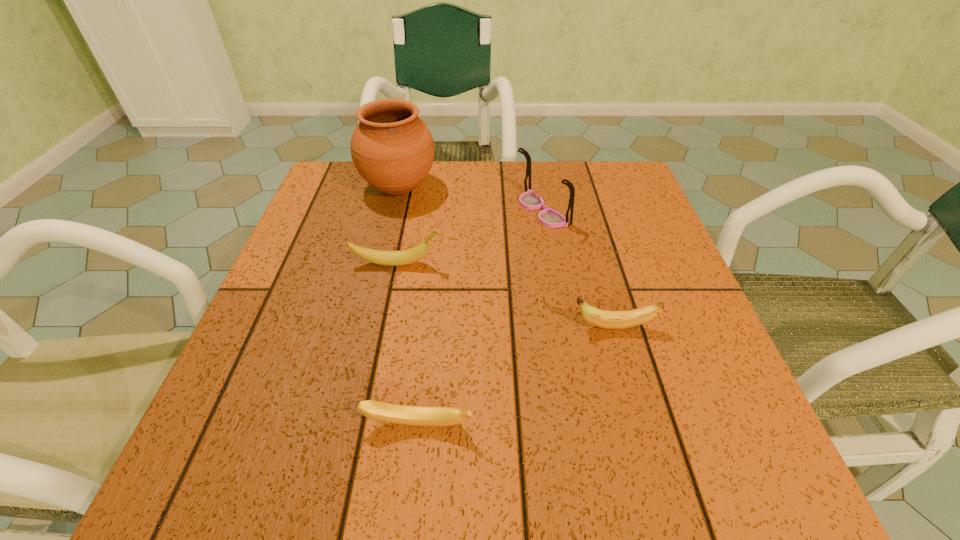
The width and height of the screenshot is (960, 540). In order to click on object that is at the far left corner in this screenshot , I will do `click(392, 149)`.

At what (x,y) coordinates should I click in order to perform the action: click on blank space at the far edge. Please return your answer as a coordinate pair (x, y). The height and width of the screenshot is (540, 960). Looking at the image, I should click on (400, 216).

What are the coordinates of `vacant space at the near edge of the desktop` in the screenshot? It's located at (411, 439).

This screenshot has height=540, width=960. Identify the location of vacant space at the left edge. (298, 306).

Locate an element on the screen. The height and width of the screenshot is (540, 960). vacant space at the right edge is located at coordinates (643, 238).

Identify the location of free space at the far left corner of the desktop. (372, 204).

You are a GUI agent. You are given a task and a screenshot of the screen. Output one action in this format:
    pyautogui.click(x=<x>, y=<y>)
    Task: Click on the vacant area at the near left corner of the desktop
    The height and width of the screenshot is (540, 960).
    Given the screenshot: What is the action you would take?
    pyautogui.click(x=229, y=486)

In the image, there is a desktop. At what (x,y) coordinates should I click in order to perform the action: click on vacant region at the far right corner. Please return your answer as a coordinate pair (x, y). The height and width of the screenshot is (540, 960). Looking at the image, I should click on (646, 201).

In order to click on empty space between the second tallest object and the nearest banana in this screenshot , I will do `click(480, 318)`.

The image size is (960, 540). In order to click on empty space that is in between the second tallest object and the third farthest object in this screenshot , I will do `click(468, 237)`.